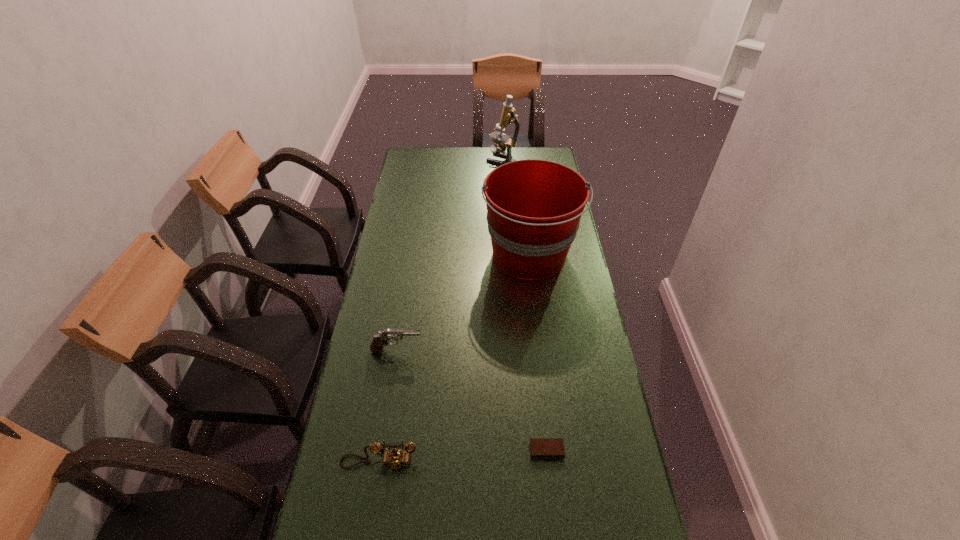
Locate an element on the screen. Image resolution: width=960 pixels, height=540 pixels. object that is at the far edge is located at coordinates (508, 116).

Locate an element on the screen. The height and width of the screenshot is (540, 960). pistol that is at the left edge is located at coordinates (379, 340).

What are the coordinates of `telephone present at the left edge` in the screenshot? It's located at (394, 459).

The image size is (960, 540). What are the coordinates of `bucket positioned at the right edge` in the screenshot? It's located at (534, 207).

At what (x,y) coordinates should I click in order to perform the action: click on alarm clock located in the right edge section of the desktop. Please return your answer as a coordinate pair (x, y). The width and height of the screenshot is (960, 540). Looking at the image, I should click on (541, 448).

What are the coordinates of `free space at the far edge of the desktop` in the screenshot? It's located at (480, 154).

Where is `free space at the left edge of the desktop`? The height and width of the screenshot is (540, 960). free space at the left edge of the desktop is located at coordinates (384, 506).

This screenshot has width=960, height=540. Find the location of `free space at the right edge of the desktop`. free space at the right edge of the desktop is located at coordinates pos(577,261).

Where is `vacant region at the far left corner of the desktop`? This screenshot has width=960, height=540. vacant region at the far left corner of the desktop is located at coordinates (430, 161).

At what (x,y) coordinates should I click in order to perform the action: click on free space that is in between the telephone and the farthest object. Please return your answer as a coordinate pair (x, y). The height and width of the screenshot is (540, 960). Looking at the image, I should click on [441, 310].